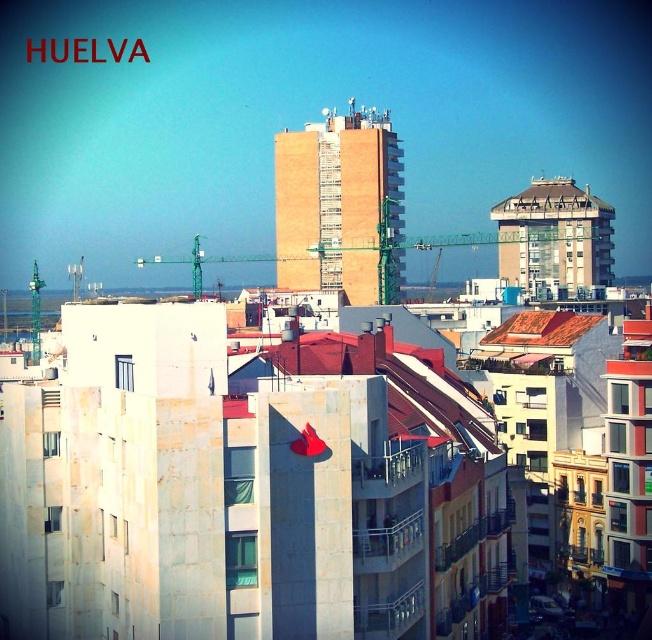
You are standing in the urban landscape of Huelva and want to take a photo of both the modern apartment buildings with light colored facades and the bright red guitar leaning against one of them. If you focus your camera on point A at point (383, 179) and point B at point (496, 211), which point should you focus on first to ensure both points are in focus?

You should focus on point A at point (383, 179) first because it is closer to the camera than point B at point (496, 211). By focusing on the closer point, the depth of field may include both points in the frame.

You are standing in the middle of the urban landscape looking at the scene. Which object would appear larger to you, the concrete building at center or the white textured roof at upper right?

The concrete building at center would appear larger because it is closer to the viewer than the white textured roof at upper right.

Looking at this image, what is located at the coordinates point (336, 200) in the image?

At point (336, 200) lies brown brick building at center.